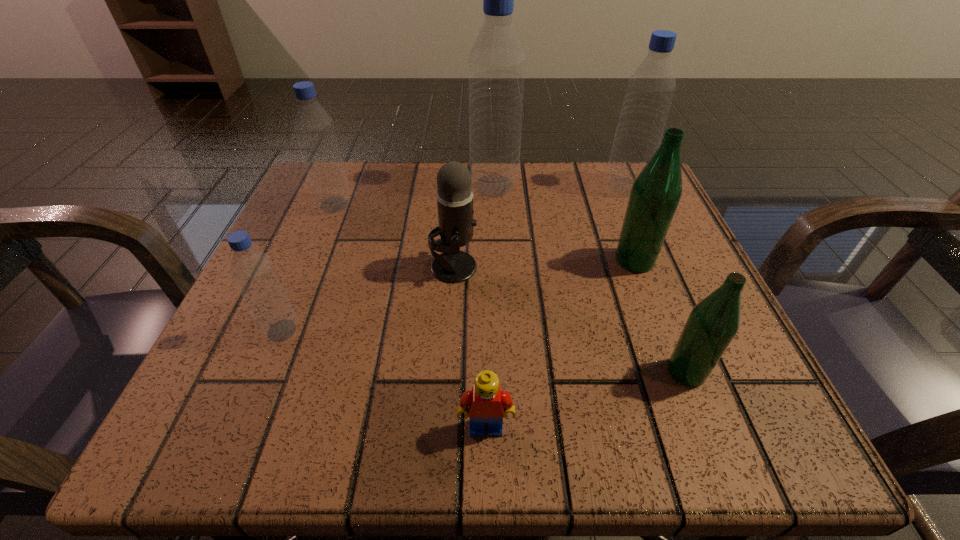
Locate an element on the screen. This screenshot has width=960, height=540. the nearer green bottle is located at coordinates (712, 324).

The image size is (960, 540). What are the coordinates of `the nearest bottle` in the screenshot? It's located at [712, 324].

Find the location of `the nearest object`. the nearest object is located at coordinates (487, 403).

You are a GUI agent. You are given a task and a screenshot of the screen. Output one action in this format:
    pyautogui.click(x=<x>, y=<y>)
    Task: Click on the shortest object
    
    Given the screenshot: What is the action you would take?
    pyautogui.click(x=487, y=403)

Locate an element on the screen. Image resolution: width=960 pixels, height=540 pixels. free space located on the right of the biggest blue bottle is located at coordinates tap(574, 186).

Where is `vacant space located 0.220m on the front of the third smallest blue bottle`? vacant space located 0.220m on the front of the third smallest blue bottle is located at coordinates (662, 272).

Locate an element on the screen. blank area located 0.090m on the back of the third biggest blue bottle is located at coordinates (348, 172).

Identify the location of free space located 0.210m on the front of the bigger green bottle. Image resolution: width=960 pixels, height=540 pixels. (681, 382).

Identify the location of vacant space located on the right of the gray microphone. The image size is (960, 540). (634, 267).

In order to click on free space located 0.060m on the front of the nearest blue bottle in this screenshot , I will do `click(260, 382)`.